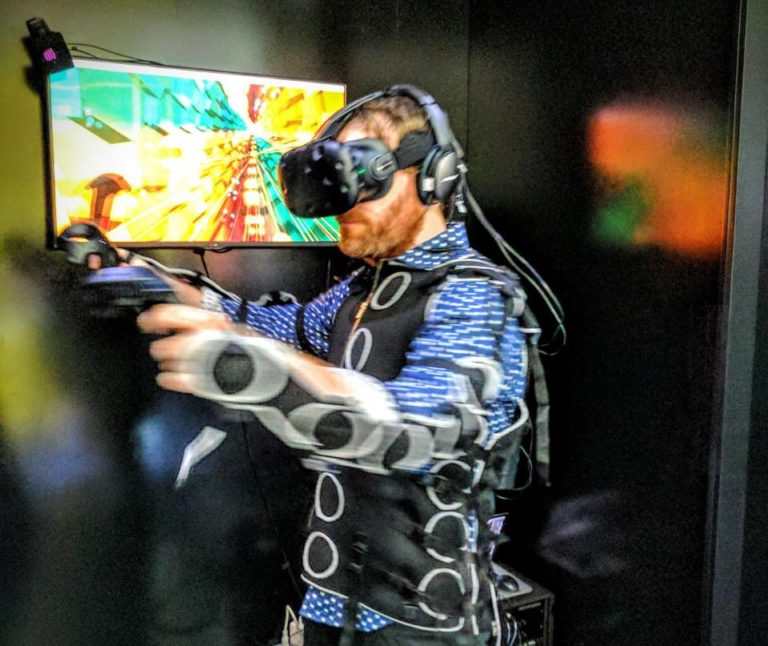
Where is `screen on the wall showing red yellow and green boxes`? This screenshot has height=646, width=768. screen on the wall showing red yellow and green boxes is located at coordinates (58, 227), (55, 92), (323, 224), (329, 109).